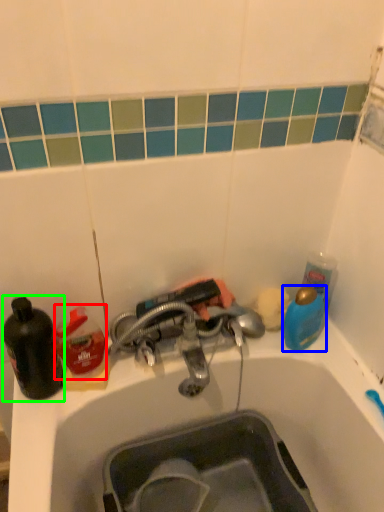
Question: Estimate the real-world distances between objects in this image. Which object is farther from cleaning product (highlighted by a red box), teal (highlighted by a blue box) or bottle (highlighted by a green box)?

Choices:
 (A) teal
 (B) bottle

Answer: (A)